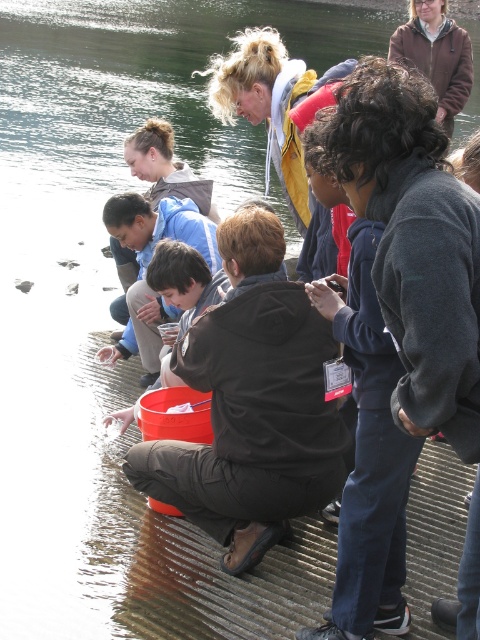
Question: Does black matte jacket at center appear on the left side of dark gray fleece jacket at center?

Choices:
 (A) yes
 (B) no

Answer: (A)

Question: Is black matte jacket at center wider than dark gray fleece jacket at center?

Choices:
 (A) yes
 (B) no

Answer: (A)

Question: Does black matte jacket at center come in front of dark gray fleece jacket at center?

Choices:
 (A) no
 (B) yes

Answer: (A)